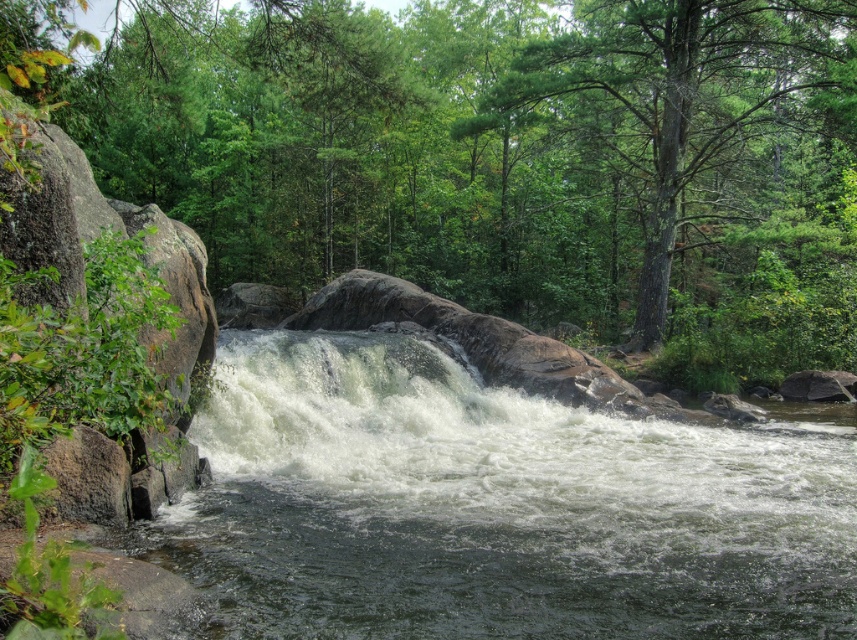
Question: Which point is farther from the camera taking this photo?

Choices:
 (A) (373, 129)
 (B) (778, 16)

Answer: (A)

Question: Which of the following is the farthest from the observer?

Choices:
 (A) (394, 214)
 (B) (664, 260)

Answer: (A)

Question: Does green leafy forest at center appear under green textured tree at upper center?

Choices:
 (A) no
 (B) yes

Answer: (A)

Question: Can you confirm if green leafy forest at center is bigger than green textured tree at upper center?

Choices:
 (A) yes
 (B) no

Answer: (A)

Question: Which point appears farthest from the camera in this image?

Choices:
 (A) (532, 92)
 (B) (642, 232)

Answer: (B)

Question: Does green leafy forest at center have a larger size compared to green textured tree at upper center?

Choices:
 (A) yes
 (B) no

Answer: (A)